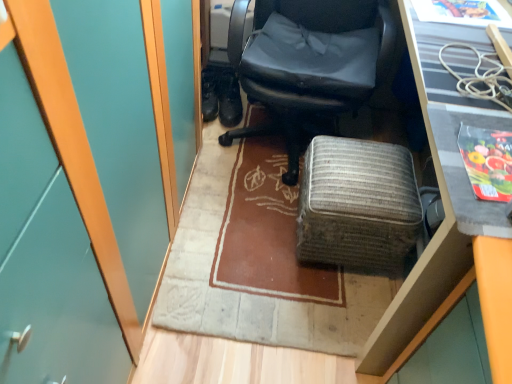
Question: Does matte black office chair at center appear on the right side of woven fabric ottoman at center?

Choices:
 (A) no
 (B) yes

Answer: (A)

Question: Is the position of matte black office chair at center less distant than that of woven fabric ottoman at center?

Choices:
 (A) yes
 (B) no

Answer: (A)

Question: Is matte black office chair at center not inside woven fabric ottoman at center?

Choices:
 (A) no
 (B) yes

Answer: (B)

Question: From the image's perspective, does matte black office chair at center appear lower than woven fabric ottoman at center?

Choices:
 (A) no
 (B) yes

Answer: (A)

Question: Is the position of matte black office chair at center more distant than that of woven fabric ottoman at center?

Choices:
 (A) no
 (B) yes

Answer: (A)

Question: Is matte black office chair at center oriented away from woven fabric ottoman at center?

Choices:
 (A) no
 (B) yes

Answer: (A)

Question: From the image's perspective, is matte black office chair at center beneath black textured desk at upper right?

Choices:
 (A) no
 (B) yes

Answer: (A)

Question: Is matte black office chair at center to the right of black textured desk at upper right from the viewer's perspective?

Choices:
 (A) no
 (B) yes

Answer: (A)

Question: Considering the relative sizes of matte black office chair at center and black textured desk at upper right in the image provided, is matte black office chair at center shorter than black textured desk at upper right?

Choices:
 (A) no
 (B) yes

Answer: (B)

Question: Could you tell me if matte black office chair at center is facing black textured desk at upper right?

Choices:
 (A) no
 (B) yes

Answer: (A)

Question: Is matte black office chair at center taller than black textured desk at upper right?

Choices:
 (A) no
 (B) yes

Answer: (A)

Question: Can you confirm if matte black office chair at center is smaller than black textured desk at upper right?

Choices:
 (A) yes
 (B) no

Answer: (A)

Question: Can you confirm if woven fabric ottoman at center is positioned to the right of black textured desk at upper right?

Choices:
 (A) no
 (B) yes

Answer: (A)